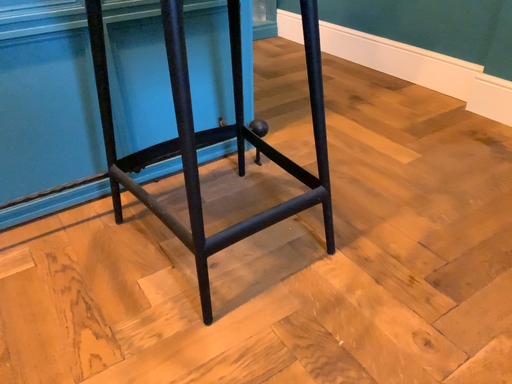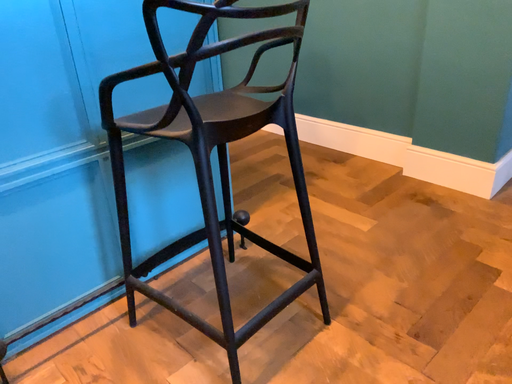
Question: Which way did the camera rotate in the video?

Choices:
 (A) rotated downward
 (B) rotated upward

Answer: (B)